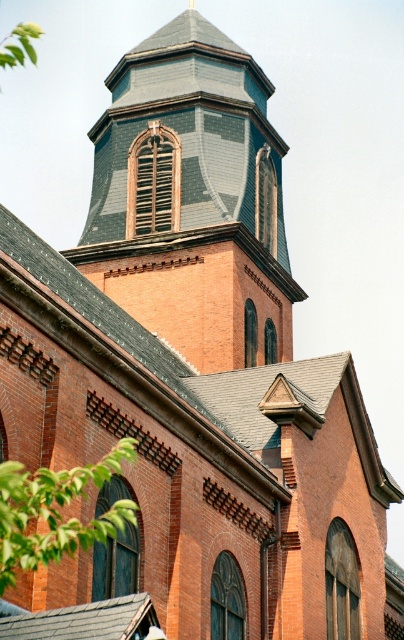
What do you see at coordinates (191, 196) in the screenshot?
I see `gray slate roof at upper center` at bounding box center [191, 196].

Which is more to the right, gray slate roof at upper center or green leafy tree at lower left?

gray slate roof at upper center is more to the right.

The image size is (404, 640). In order to click on gray slate roof at upper center in this screenshot , I will do `click(191, 196)`.